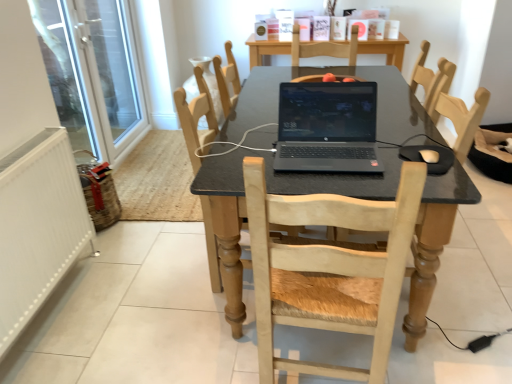
Where is `vacant space situated on the left part of light wood chair at center, which ranks as the 1th chair in front-to-back order`? The width and height of the screenshot is (512, 384). vacant space situated on the left part of light wood chair at center, which ranks as the 1th chair in front-to-back order is located at coordinates (213, 345).